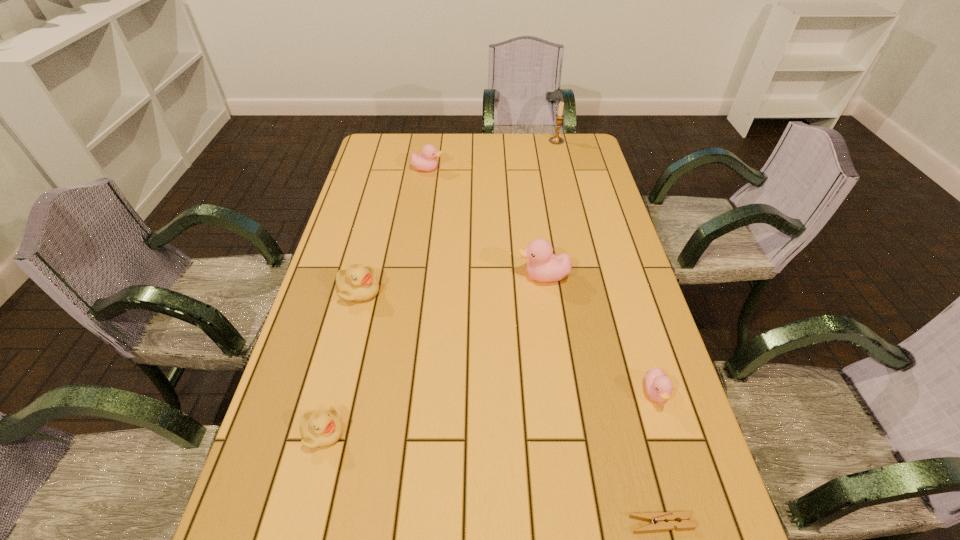
Identify the location of blank space located on the beak of the nearer yellow duckling. The height and width of the screenshot is (540, 960). (493, 432).

Locate an element on the screen. free location located 0.380m on the back of the nearest object is located at coordinates (615, 347).

You are a GUI agent. You are given a task and a screenshot of the screen. Output one action in this format:
    pyautogui.click(x=<x>, y=<y>)
    Task: Click on the candle holder positioned at the far edge
    The width and height of the screenshot is (960, 540).
    Given the screenshot: What is the action you would take?
    pyautogui.click(x=556, y=140)

Where is `duckling situated at the far edge`? duckling situated at the far edge is located at coordinates (427, 161).

At what (x,y) coordinates should I click in order to perform the action: click on candle holder that is positioned at the right edge. Please return your answer as a coordinate pair (x, y). This screenshot has height=540, width=960. Looking at the image, I should click on (556, 140).

At what (x,y) coordinates should I click in order to perform the action: click on duckling situated at the right edge. Please return your answer as a coordinate pair (x, y). The width and height of the screenshot is (960, 540). Looking at the image, I should click on (658, 385).

Where is `clothespin positioned at the right edge`? Image resolution: width=960 pixels, height=540 pixels. clothespin positioned at the right edge is located at coordinates (659, 518).

What are the coordinates of `object that is at the far right corner` in the screenshot? It's located at (556, 140).

Find the location of a particular element. The width and height of the screenshot is (960, 540). vacant area at the far edge is located at coordinates (551, 156).

In the image, there is a desktop. Where is `vacant space at the left edge`? This screenshot has height=540, width=960. vacant space at the left edge is located at coordinates (374, 201).